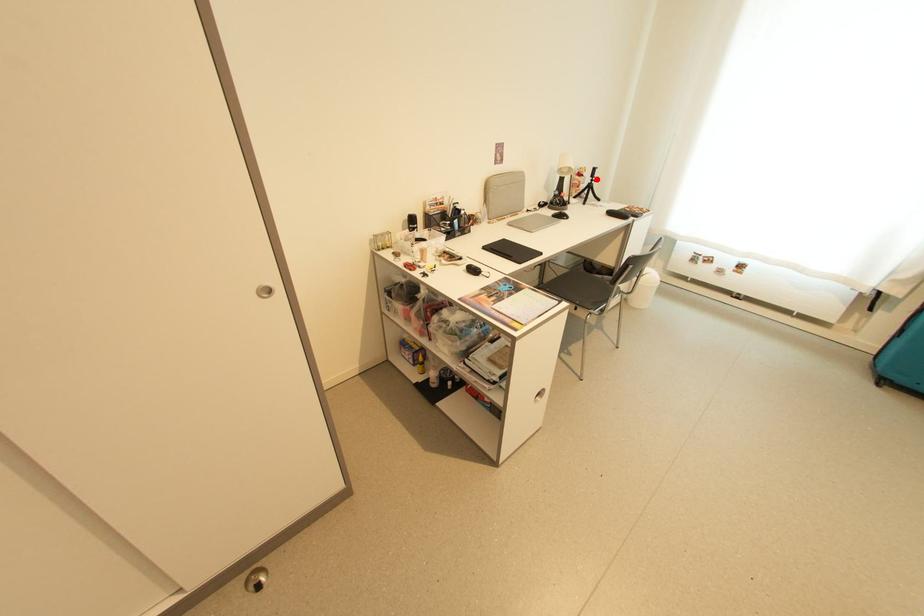
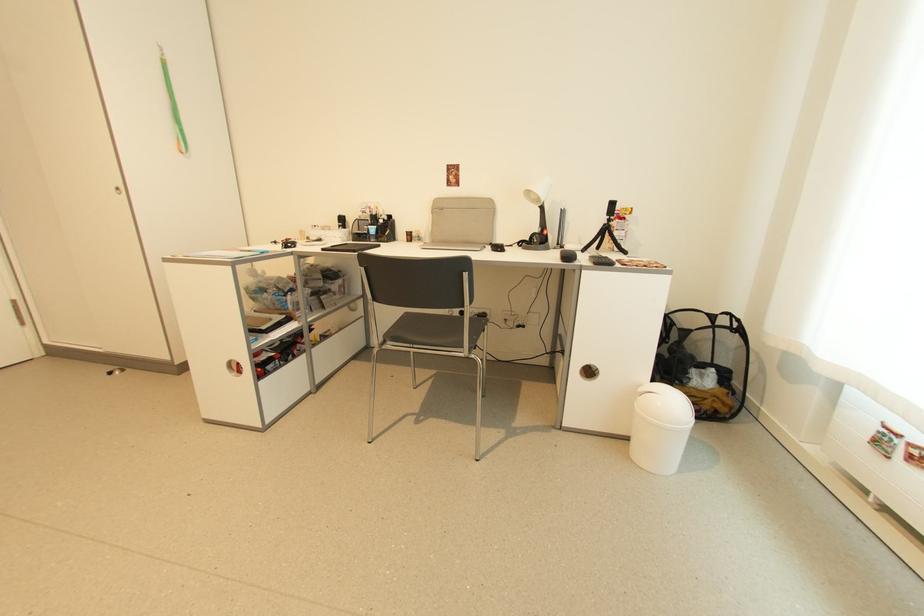
Question: I am providing you with two images of the same scene from different viewpoints. A red point is shown in image1. For the corresponding object point in image2, is it positioned nearer or farther from the camera?

Choices:
 (A) Nearer
 (B) Farther

Answer: (B)